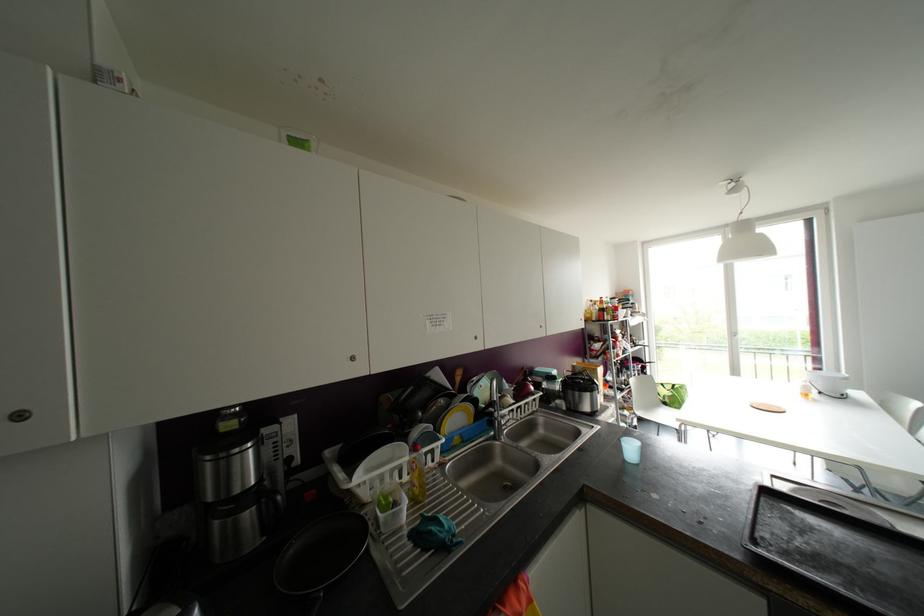
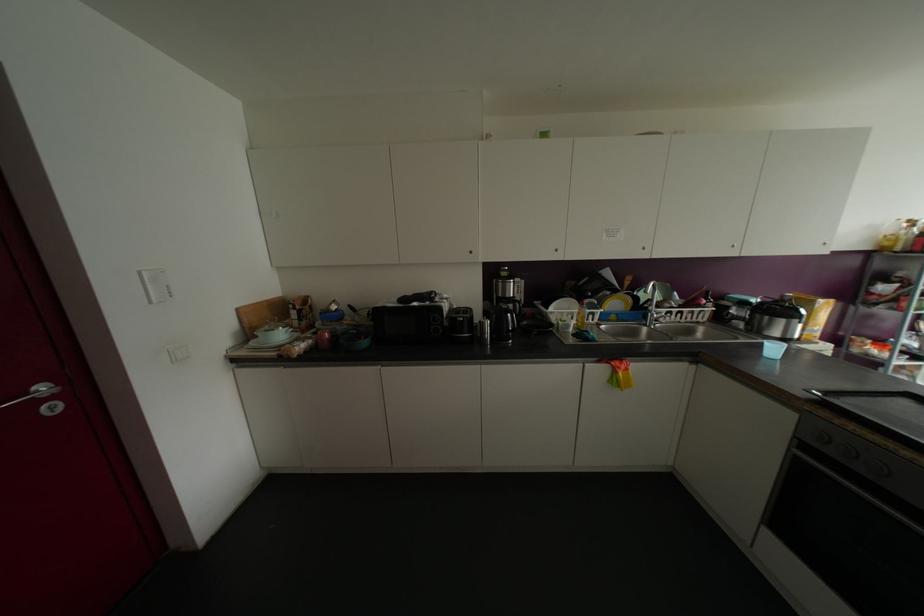
The point at [351,358] is marked in the first image. Where is the corresponding point in the second image?

(555, 249)